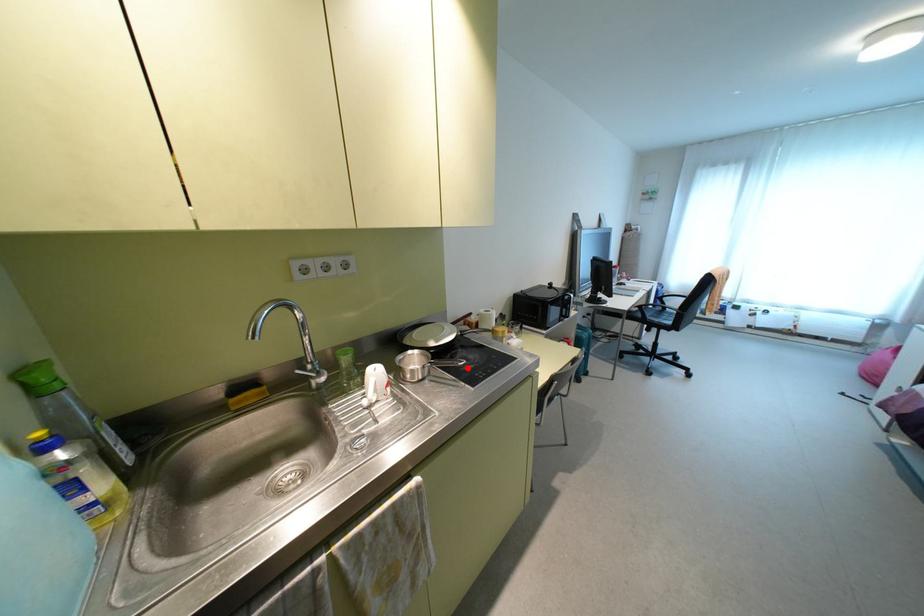
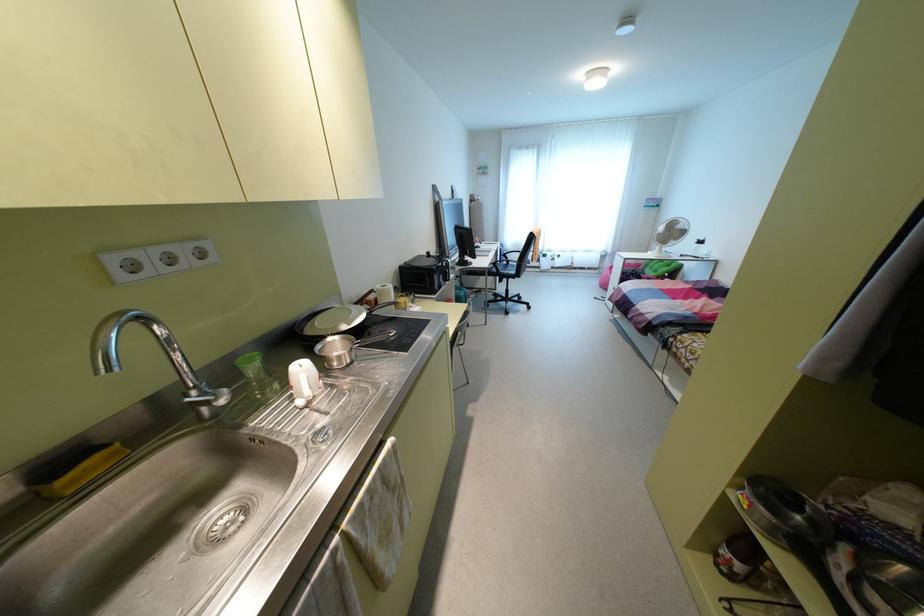
Locate, in the second image, the point that corresponds to the highlighted location in the first image.

(392, 339)